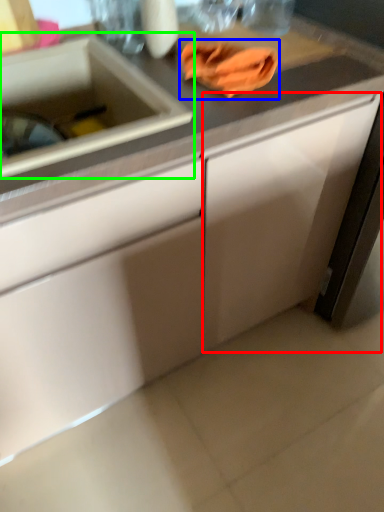
Question: Considering the real-world distances, which object is farthest from cabinetry (highlighted by a red box)? hand towel (highlighted by a blue box) or sink (highlighted by a green box)?

Choices:
 (A) hand towel
 (B) sink

Answer: (B)